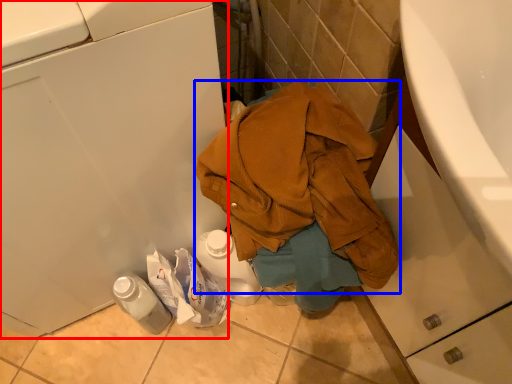
Question: Which object is closer to the camera taking this photo, washing machine (highlighted by a red box) or waste (highlighted by a blue box)?

Choices:
 (A) washing machine
 (B) waste

Answer: (A)